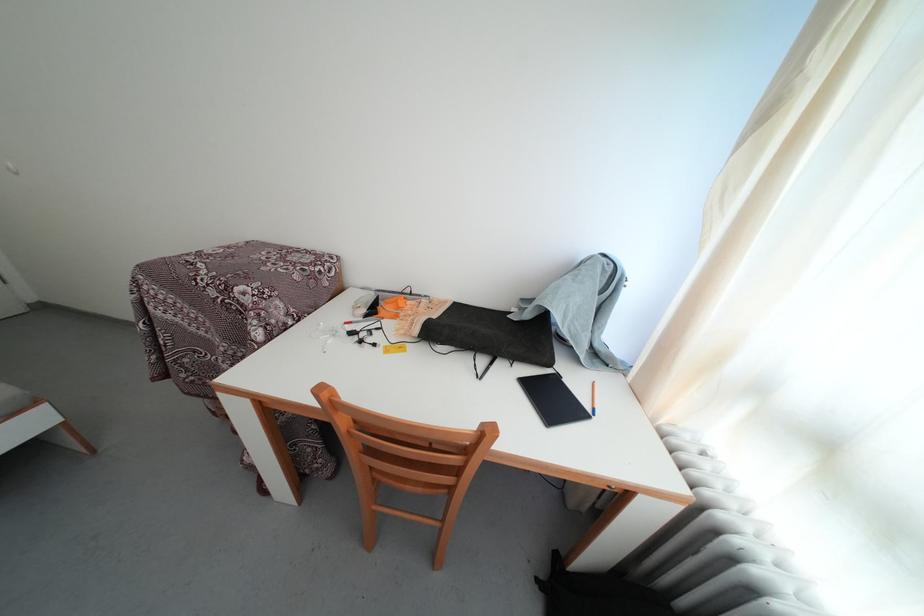
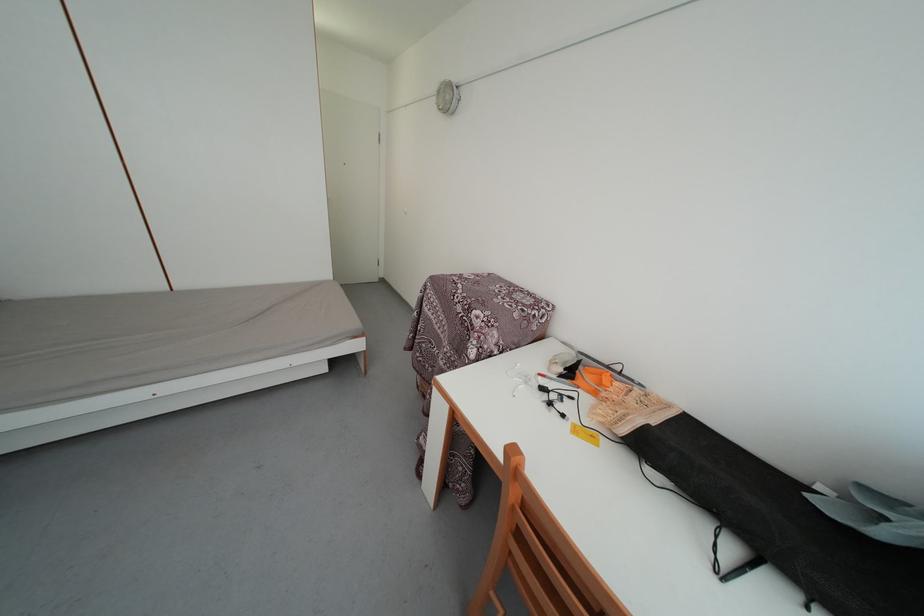
Question: The images are taken continuously from a first-person perspective. In which direction is your viewpoint rotating?

Choices:
 (A) Left
 (B) Right
 (C) Up
 (D) Down

Answer: (A)